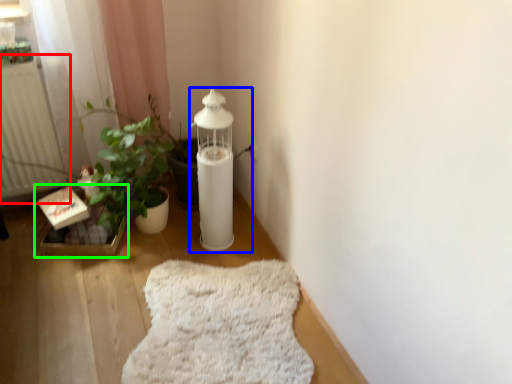
Question: Based on their relative distances, which object is farther from radiator (highlighted by a red box)? Choose from oil lamp (highlighted by a blue box) and window sill (highlighted by a green box).

Choices:
 (A) oil lamp
 (B) window sill

Answer: (A)